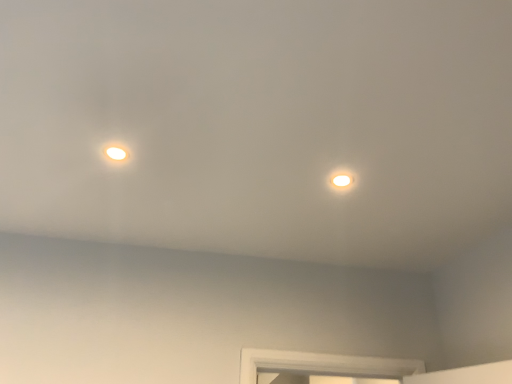
Question: Does matte white light at upper right have a smaller size compared to matte white droplight at upper left?

Choices:
 (A) yes
 (B) no

Answer: (A)

Question: Does matte white light at upper right lie behind matte white droplight at upper left?

Choices:
 (A) yes
 (B) no

Answer: (A)

Question: Could you tell me if matte white light at upper right is turned towards matte white droplight at upper left?

Choices:
 (A) yes
 (B) no

Answer: (B)

Question: Is matte white light at upper right at the right side of matte white droplight at upper left?

Choices:
 (A) yes
 (B) no

Answer: (A)

Question: Is matte white droplight at upper left at the back of matte white light at upper right?

Choices:
 (A) no
 (B) yes

Answer: (A)

Question: Is matte white light at upper right placed right next to matte white droplight at upper left?

Choices:
 (A) yes
 (B) no

Answer: (B)

Question: From the image's perspective, is matte white droplight at upper left located above matte white light at upper right?

Choices:
 (A) yes
 (B) no

Answer: (A)

Question: Are matte white droplight at upper left and matte white light at upper right far apart?

Choices:
 (A) yes
 (B) no

Answer: (B)

Question: Is the depth of matte white droplight at upper left less than that of matte white light at upper right?

Choices:
 (A) yes
 (B) no

Answer: (A)

Question: Is matte white light at upper right inside matte white droplight at upper left?

Choices:
 (A) no
 (B) yes

Answer: (A)

Question: From a real-world perspective, is matte white droplight at upper left on top of matte white light at upper right?

Choices:
 (A) yes
 (B) no

Answer: (B)

Question: Does matte white droplight at upper left have a smaller size compared to matte white light at upper right?

Choices:
 (A) yes
 (B) no

Answer: (B)

Question: Does point (339, 170) appear closer or farther from the camera than point (119, 152)?

Choices:
 (A) farther
 (B) closer

Answer: (A)